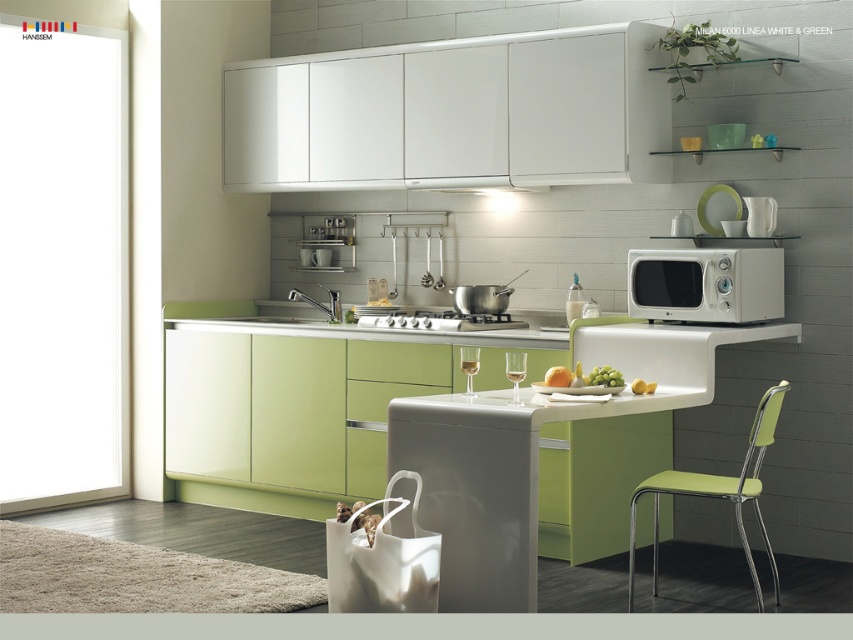
You are a delivery person who needs to place a 1.5 meter long package between the white matte microwave at upper right and the green matte apple at center. Can you fit it there?

The distance between the white matte microwave at upper right and the green matte apple at center is 1.43 meters, so the 1.5 meter long package cannot fit between them as it is longer than the available space.

You are standing in the kitchen and need to move the green plastic chair at lower right to the center of the room. What are the coordinates of the center of the room?

The center of the room is at point coordinates that are not provided in the scene description. The scene description only mentions the position of the green plastic chair at lower right at point (717, 493). Without additional spatial information about the room dimensions or layout, the exact coordinates of the center cannot be determined.

You are standing in the kitchen and want to reach the point at coordinates point (751, 566). If your maximum reach is 14 feet, can you reach it without moving?

The point (751, 566) is 14.70 feet from the camera, which is beyond your maximum reach of 14 feet. Therefore, you cannot reach it without moving.